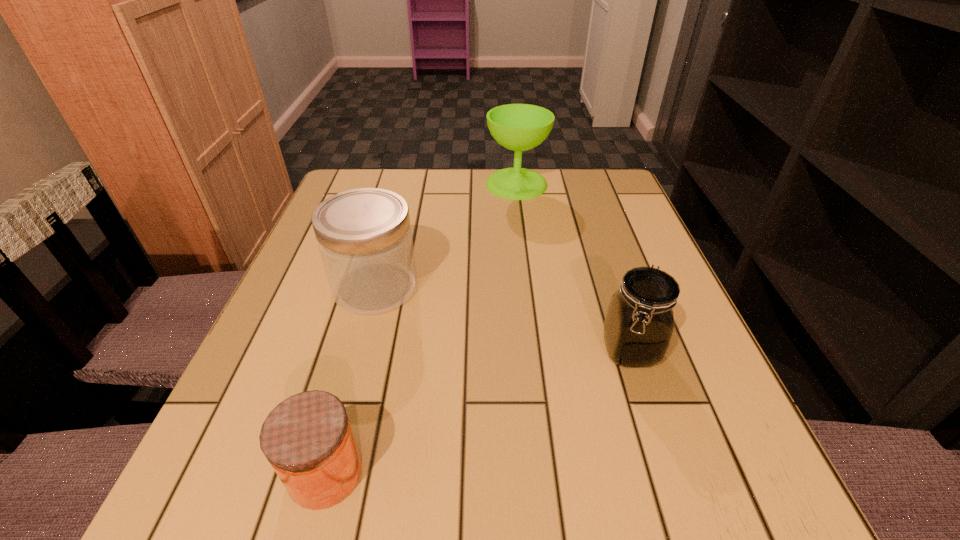
Where is `vacant position at the near right corner of the desktop`? The image size is (960, 540). vacant position at the near right corner of the desktop is located at coordinates (704, 522).

Identify the location of vacant area that lies between the shortest object and the second farthest object. The width and height of the screenshot is (960, 540). (350, 380).

The height and width of the screenshot is (540, 960). What are the coordinates of `free point between the farthest object and the farthest jar` in the screenshot? It's located at (446, 235).

I want to click on vacant space that's between the second farthest object and the rightmost object, so click(x=503, y=319).

The width and height of the screenshot is (960, 540). What are the coordinates of `free space between the third object from left to right and the nearest jar` in the screenshot? It's located at (421, 328).

The image size is (960, 540). I want to click on free space between the third object from left to right and the nearest object, so click(421, 328).

Where is `free space between the farthest object and the shortest object`? The image size is (960, 540). free space between the farthest object and the shortest object is located at coordinates (421, 328).

Where is `free spot between the third object from left to right and the third nearest object`? Image resolution: width=960 pixels, height=540 pixels. free spot between the third object from left to right and the third nearest object is located at coordinates (446, 235).

Locate an element on the screen. vacant area that lies between the wineglass and the second nearest object is located at coordinates (573, 267).

I want to click on vacant space that's between the wineglass and the second farthest object, so click(446, 235).